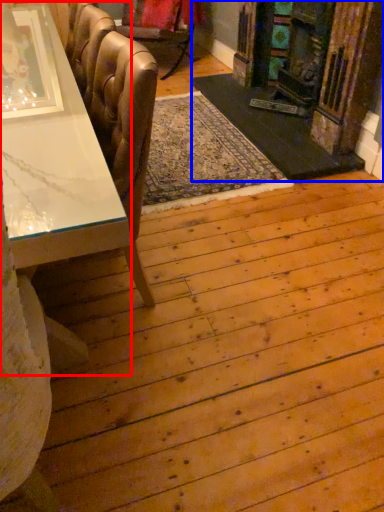
Question: Which point is further to the camera, table (highlighted by a red box) or fireplace (highlighted by a blue box)?

Choices:
 (A) table
 (B) fireplace

Answer: (B)